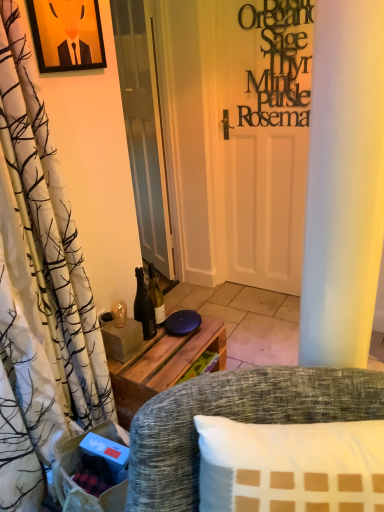
Question: Which is correct: white glossy door at center is inside shiny glass bottle at center, or outside of it?

Choices:
 (A) outside
 (B) inside

Answer: (A)

Question: In the image, is white glossy door at center on the left side or the right side of shiny glass bottle at center?

Choices:
 (A) right
 (B) left

Answer: (B)

Question: Which of these objects is positioned farthest from the textured gray fabric chair at lower center?

Choices:
 (A) white glossy door at center
 (B) shiny glass bottle at center
 (C) matte black picture frame at upper left
 (D) black matte sign at upper right

Answer: (A)

Question: Which object is positioned farthest from the black matte sign at upper right?

Choices:
 (A) white glossy door at center
 (B) textured gray fabric chair at lower center
 (C) shiny glass bottle at center
 (D) matte black picture frame at upper left

Answer: (B)